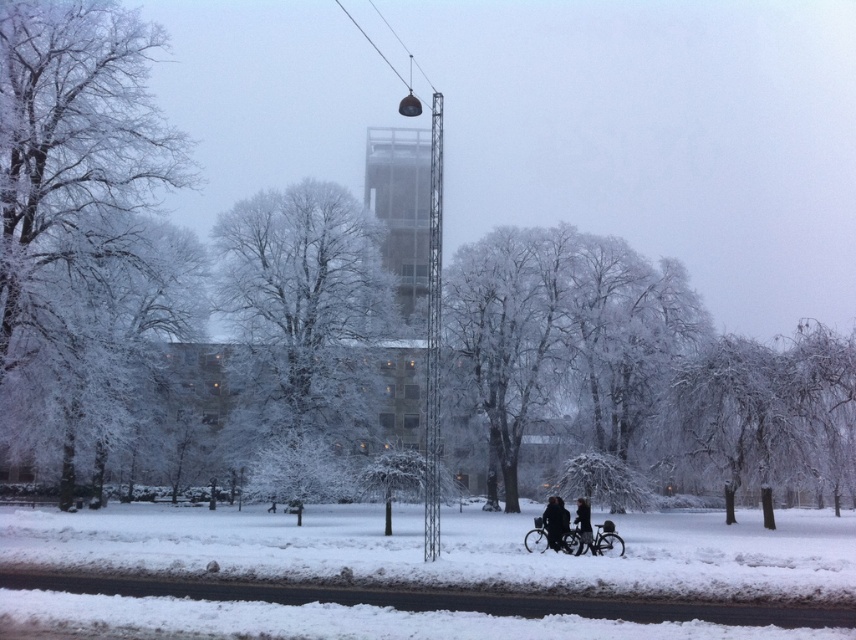
Which is behind, point (452, 508) or point (575, 508)?

The point (452, 508) is more distant.

Is white fluffy snow at lower center below dark gray jacket at lower center?

Indeed, white fluffy snow at lower center is positioned under dark gray jacket at lower center.

Is point (461, 576) more distant than point (581, 525)?

No, it is not.

I want to click on white fluffy snow at lower center, so (447, 550).

Locate an element on the screen. Image resolution: width=856 pixels, height=640 pixels. shiny metallic bicycle at lower center is located at coordinates (536, 538).

Who is more distant from viewer, (528, 548) or (556, 515)?

Point (556, 515)

The width and height of the screenshot is (856, 640). I want to click on shiny metallic bicycle at lower center, so click(x=536, y=538).

Is white fluffy snow at lower center above silver metallic bicycle at lower center?

Actually, white fluffy snow at lower center is below silver metallic bicycle at lower center.

Can you confirm if white fluffy snow at lower center is taller than silver metallic bicycle at lower center?

Indeed, white fluffy snow at lower center has a greater height compared to silver metallic bicycle at lower center.

What do you see at coordinates (447, 550) in the screenshot?
I see `white fluffy snow at lower center` at bounding box center [447, 550].

Identify the location of white fluffy snow at lower center. The width and height of the screenshot is (856, 640). (447, 550).